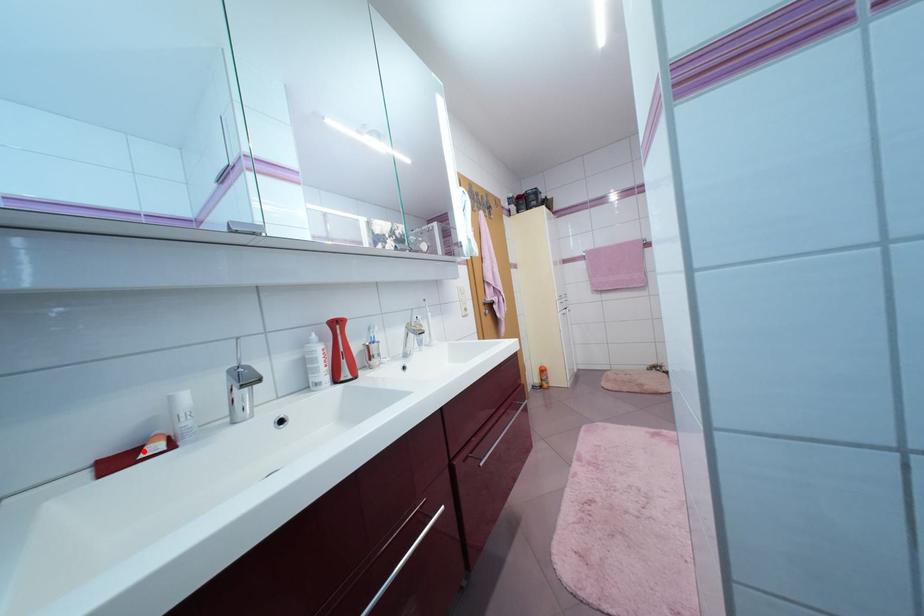
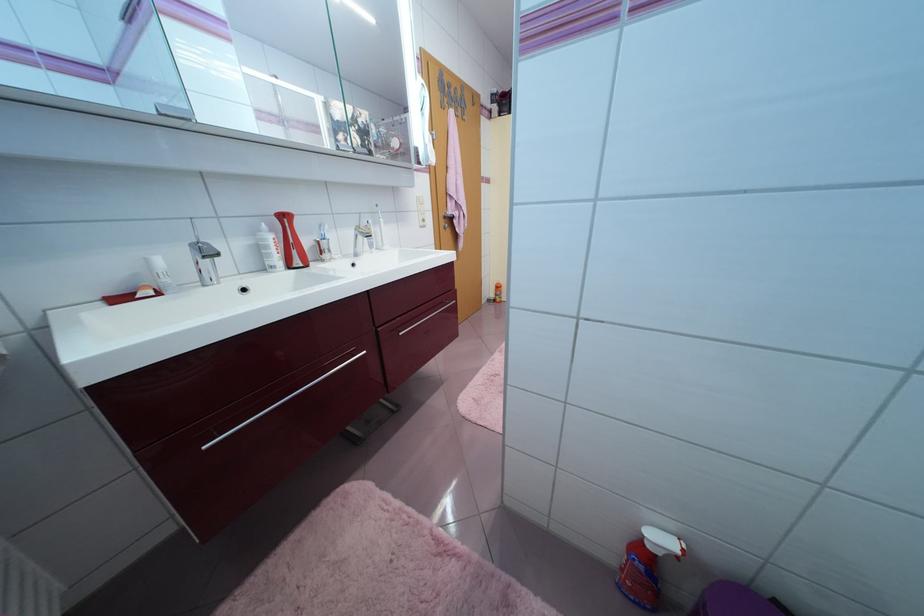
Where in the second image is the point corresponding to the highlighted location from the first image?

(140, 294)